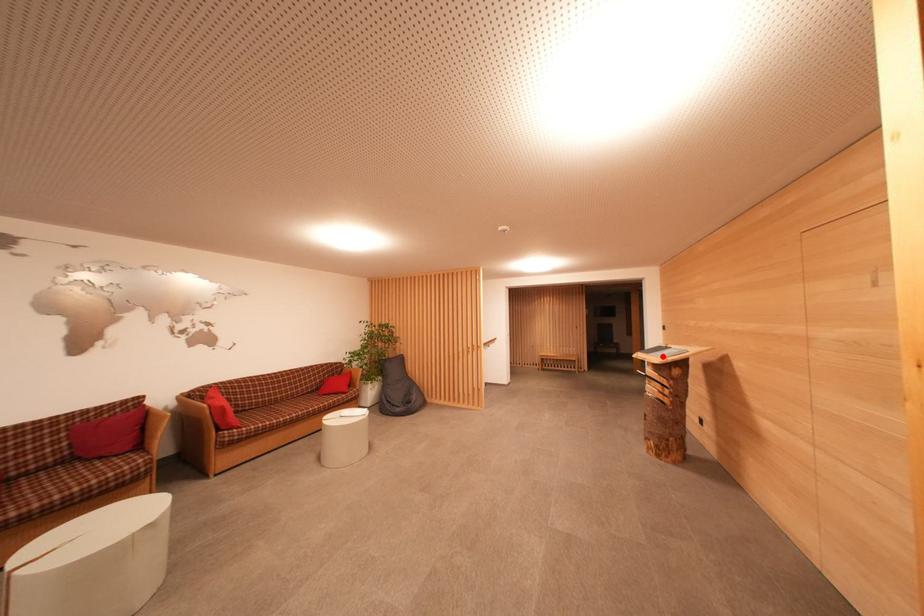
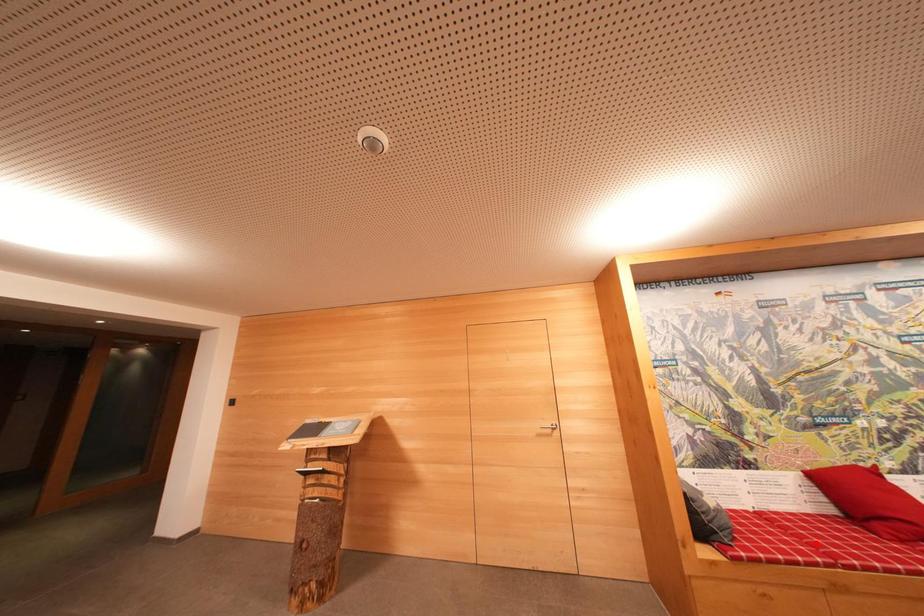
I am providing you with two images of the same scene from different viewpoints. A red point is marked on the first image and another point is marked on the second image. Are the points marked in image1 and image2 representing the same 3D position?

No